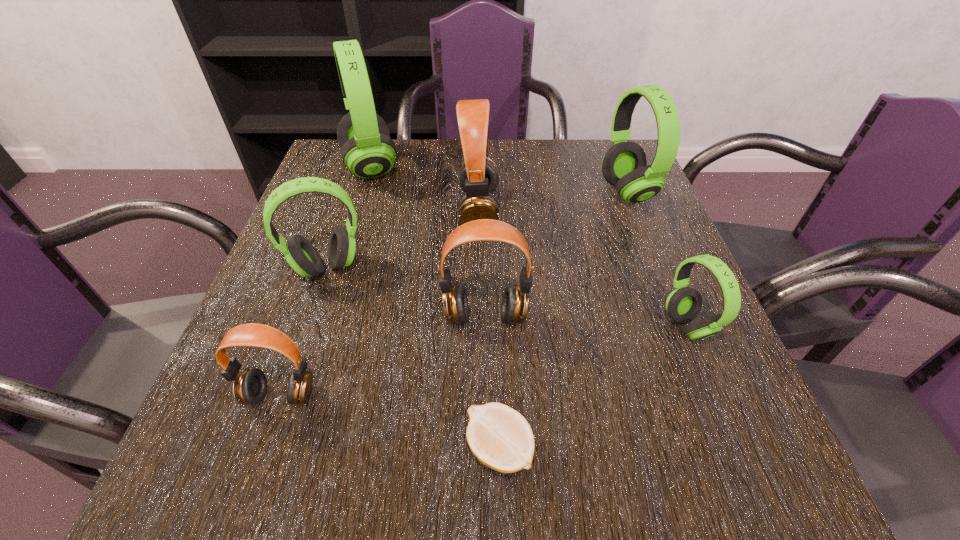
Where is `object that is the fourth nearest to the biggest green headset`? Image resolution: width=960 pixels, height=540 pixels. object that is the fourth nearest to the biggest green headset is located at coordinates (624, 166).

Find the location of a particular element. This screenshot has width=960, height=540. headset that is the second closest to the nearest object is located at coordinates (250, 386).

Find the location of a particular element. headset that is the sixth nearest to the smallest green headset is located at coordinates (367, 150).

Identify the location of green headset that is the second nearest to the tallest object. The height and width of the screenshot is (540, 960). (624, 166).

The height and width of the screenshot is (540, 960). I want to click on green headset that is the third closest to the third smallest green headset, so click(301, 255).

Identify which brown headset is located as the nearest to the nearest object. Please provide its 2D coordinates. Your answer should be formatted as a tuple, i.e. [(x, y)], where the tuple contains the x and y coordinates of a point satisfying the conditions above.

[(514, 307)]

At what (x,y) coordinates should I click in order to perform the action: click on brown headset that is the closest to the tallest headset. Please return your answer as a coordinate pair (x, y). Image resolution: width=960 pixels, height=540 pixels. Looking at the image, I should click on (478, 178).

Find the location of a particular element. vacant space that satisfies the following two spatial constraints: 1. on the ear cups of the farthest brown headset; 2. on the right side of the yellow lemon is located at coordinates (478, 449).

Where is `free space that satisfies the following two spatial constraints: 1. on the ear cups of the biggest brown headset; 2. on the back side of the nearest green headset`? free space that satisfies the following two spatial constraints: 1. on the ear cups of the biggest brown headset; 2. on the back side of the nearest green headset is located at coordinates (479, 326).

I want to click on free point that satisfies the following two spatial constraints: 1. on the front side of the tallest object; 2. on the left side of the nearest green headset, so click(x=321, y=326).